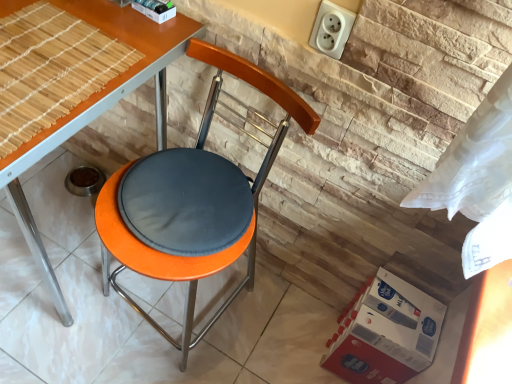
Find the location of a particular element. Image resolution: width=512 pixels, height=384 pixels. vacant space in orange matte table at center (from a real-world perspective) is located at coordinates (54, 238).